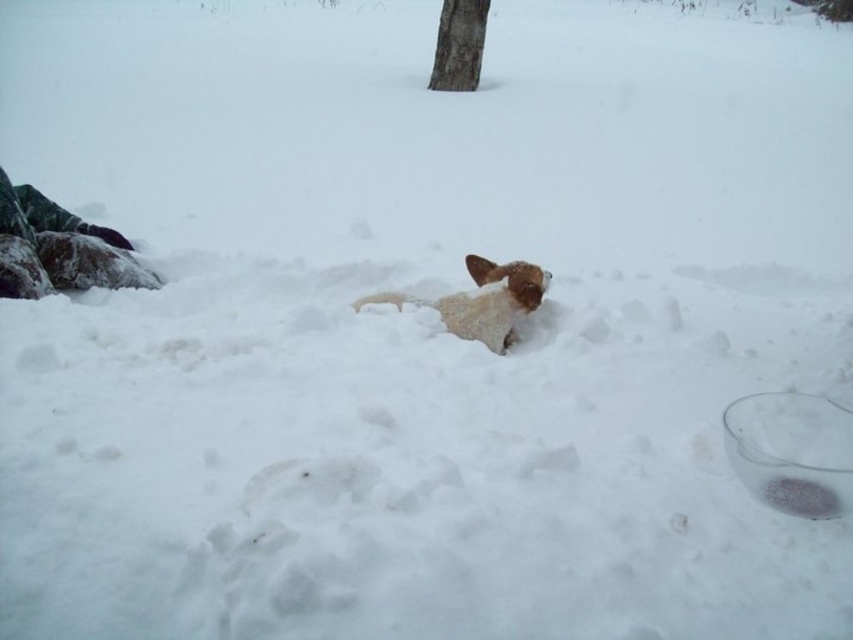
Question: Is brown fur dog at center positioned before brown rough bark tree at upper center?

Choices:
 (A) no
 (B) yes

Answer: (B)

Question: Is brown fur dog at center smaller than brown rough bark tree at upper center?

Choices:
 (A) no
 (B) yes

Answer: (B)

Question: Observing the image, what is the correct spatial positioning of brown fur dog at center in reference to brown rough bark tree at upper center?

Choices:
 (A) right
 (B) left

Answer: (B)